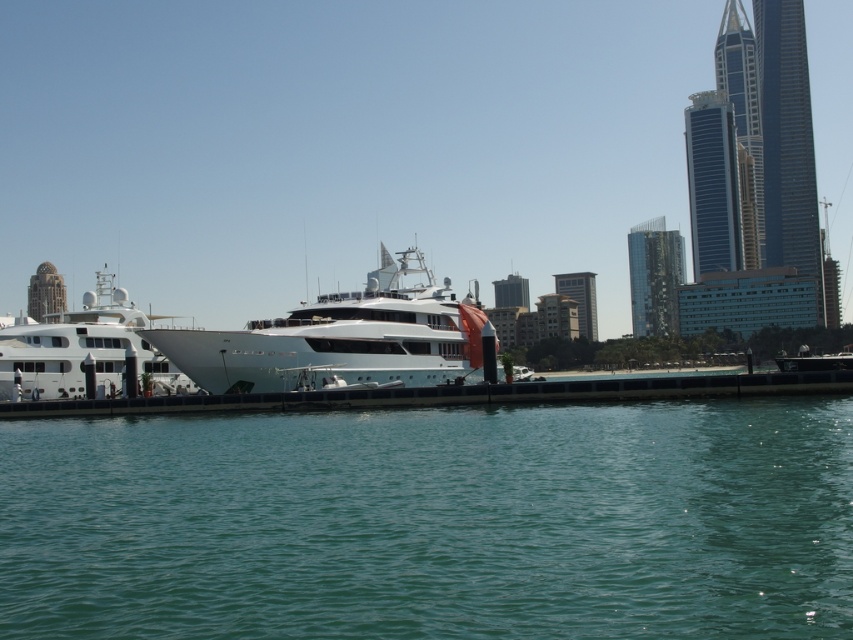
Question: Is clear blue water at lower center above white glossy yacht at center?

Choices:
 (A) yes
 (B) no

Answer: (B)

Question: Considering the real-world distances, which object is closest to the white glossy yacht at left?

Choices:
 (A) white glossy yacht at center
 (B) clear blue water at lower center

Answer: (A)

Question: Which of the following is the farthest from the observer?

Choices:
 (A) clear blue water at lower center
 (B) white glossy yacht at center
 (C) white glossy yacht at left

Answer: (C)

Question: Does clear blue water at lower center have a smaller size compared to white glossy yacht at left?

Choices:
 (A) yes
 (B) no

Answer: (A)

Question: Is white glossy yacht at center below white glossy yacht at left?

Choices:
 (A) yes
 (B) no

Answer: (A)

Question: Which is farther from the clear blue water at lower center?

Choices:
 (A) white glossy yacht at left
 (B) white glossy yacht at center

Answer: (A)